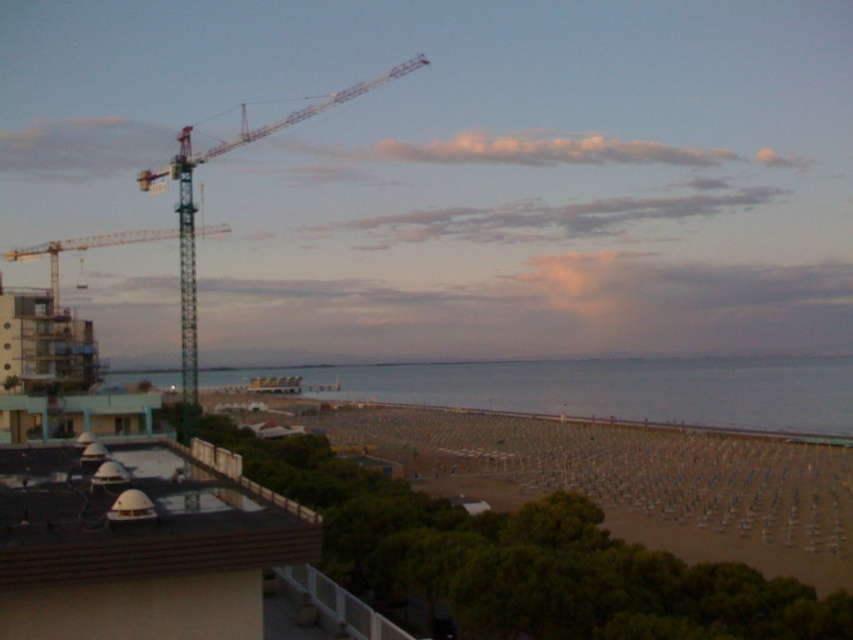
Question: Can you confirm if blue water at center is positioned to the right of yellow metallic crane at upper left?

Choices:
 (A) yes
 (B) no

Answer: (A)

Question: Among these points, which one is farthest from the camera?

Choices:
 (A) (131, 230)
 (B) (457, 420)
 (C) (331, 365)
 (D) (262, 129)

Answer: (D)

Question: Observing the image, what is the correct spatial positioning of green metallic crane at upper left in reference to yellow metallic crane at upper left?

Choices:
 (A) above
 (B) below

Answer: (A)

Question: Which of the following is the farthest from the observer?

Choices:
 (A) (47, 246)
 (B) (323, 99)
 (C) (469, 449)
 (D) (717, 374)

Answer: (B)

Question: Is green metallic crane at upper left behind yellow metallic crane at upper left?

Choices:
 (A) no
 (B) yes

Answer: (A)

Question: Which point is farther from the camera taking this photo?

Choices:
 (A) (776, 515)
 (B) (166, 237)
 (C) (666, 372)
 (D) (308, 112)

Answer: (D)